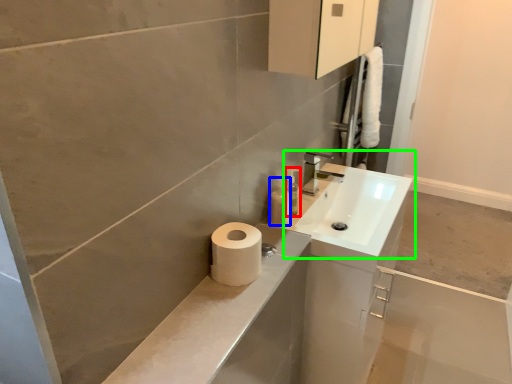
Question: Which is nearer to the soap dispenser (highlighted by a red box)? toiletry (highlighted by a blue box) or sink (highlighted by a green box).

Choices:
 (A) toiletry
 (B) sink

Answer: (A)